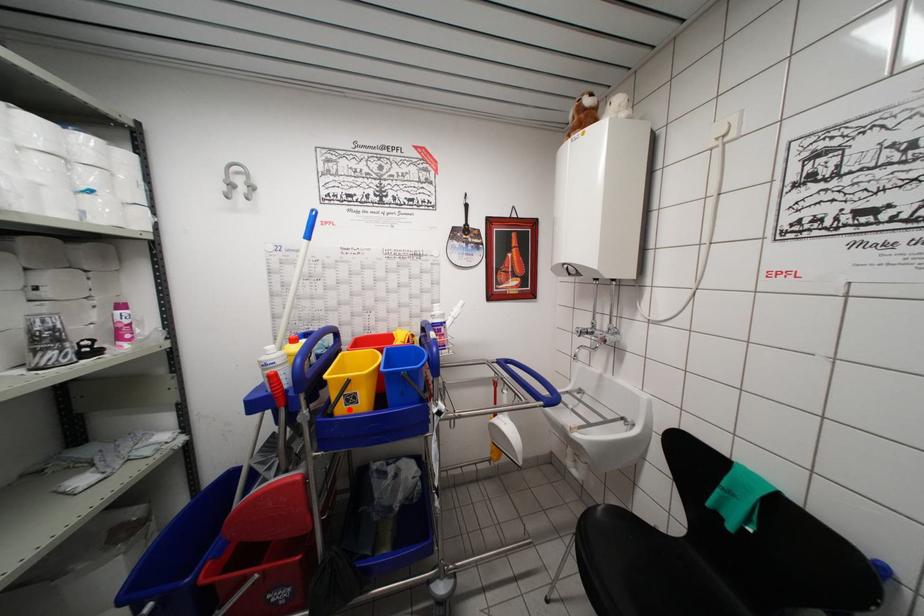
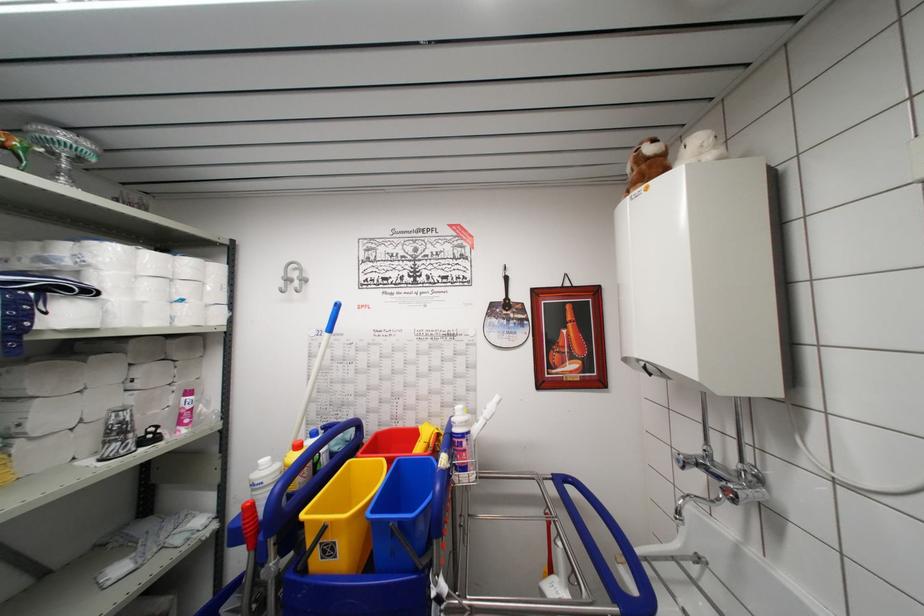
Locate, in the second image, the point that corresponds to the highlighted location in the first image.

(325, 562)